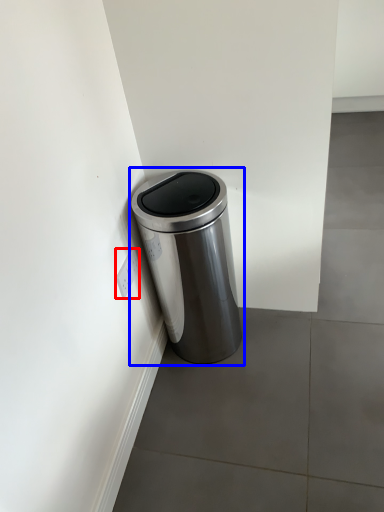
Question: Which point is further to the camera, electric outlet (highlighted by a red box) or waste container (highlighted by a blue box)?

Choices:
 (A) electric outlet
 (B) waste container

Answer: (A)